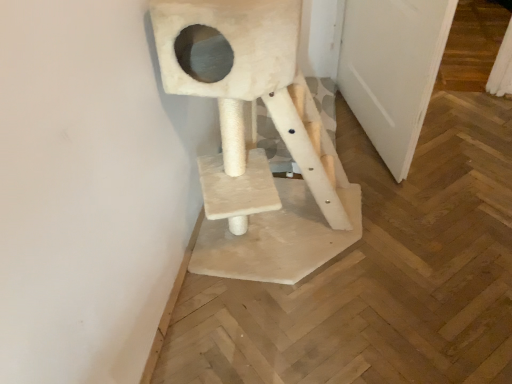
The height and width of the screenshot is (384, 512). What are the coordinates of `free space in front of white matte door at right` in the screenshot? It's located at (415, 196).